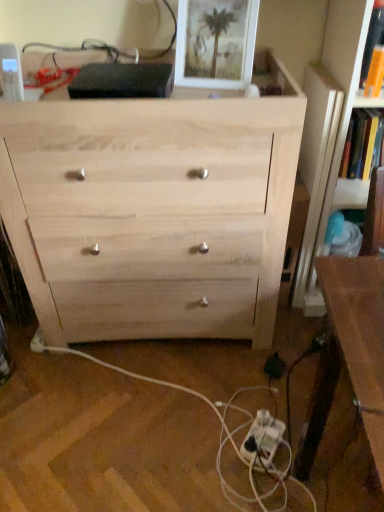
Question: Does orange paper book at upper right, marked as the second book in a right-to-left arrangement, have a lesser width compared to white matte picture frame at upper center?

Choices:
 (A) no
 (B) yes

Answer: (B)

Question: From a real-world perspective, does orange paper book at upper right, which appears as the first book when viewed from the front, stand above white matte picture frame at upper center?

Choices:
 (A) no
 (B) yes

Answer: (A)

Question: Is orange paper book at upper right, which appears as the first book when viewed from the front, at the right side of white matte picture frame at upper center?

Choices:
 (A) yes
 (B) no

Answer: (A)

Question: Considering the relative sizes of orange paper book at upper right, acting as the 1th book starting from the left, and white matte picture frame at upper center in the image provided, is orange paper book at upper right, acting as the 1th book starting from the left, shorter than white matte picture frame at upper center?

Choices:
 (A) yes
 (B) no

Answer: (A)

Question: Can you confirm if orange paper book at upper right, marked as the second book in a right-to-left arrangement, is bigger than white matte picture frame at upper center?

Choices:
 (A) no
 (B) yes

Answer: (A)

Question: From a real-world perspective, is white matte picture frame at upper center positioned above or below natural wood chest of drawers at center?

Choices:
 (A) below
 (B) above

Answer: (B)

Question: From the image's perspective, is white matte picture frame at upper center above or below natural wood chest of drawers at center?

Choices:
 (A) below
 (B) above

Answer: (B)

Question: Looking at the image, does white matte picture frame at upper center seem bigger or smaller compared to natural wood chest of drawers at center?

Choices:
 (A) big
 (B) small

Answer: (B)

Question: Is white matte picture frame at upper center inside the boundaries of natural wood chest of drawers at center, or outside?

Choices:
 (A) inside
 (B) outside

Answer: (A)

Question: Is orange paper book at upper right, acting as the second book starting from the back, wider or thinner than brown wooden table at right?

Choices:
 (A) wide
 (B) thin

Answer: (B)

Question: From the image's perspective, is orange paper book at upper right, which appears as the first book when viewed from the front, positioned above or below brown wooden table at right?

Choices:
 (A) above
 (B) below

Answer: (A)

Question: Is orange paper book at upper right, which appears as the first book when viewed from the front, taller or shorter than brown wooden table at right?

Choices:
 (A) tall
 (B) short

Answer: (B)

Question: Based on their positions, is orange paper book at upper right, marked as the second book in a right-to-left arrangement, located to the left or right of brown wooden table at right?

Choices:
 (A) right
 (B) left

Answer: (B)

Question: Is hardcover book at upper right, which ranks as the second book in front-to-back order, bigger or smaller than orange paper book at upper right, which appears as the first book when viewed from the front?

Choices:
 (A) big
 (B) small

Answer: (A)

Question: Is hardcover book at upper right, the 2th book from the left, situated inside orange paper book at upper right, acting as the 1th book starting from the left, or outside?

Choices:
 (A) inside
 (B) outside

Answer: (B)